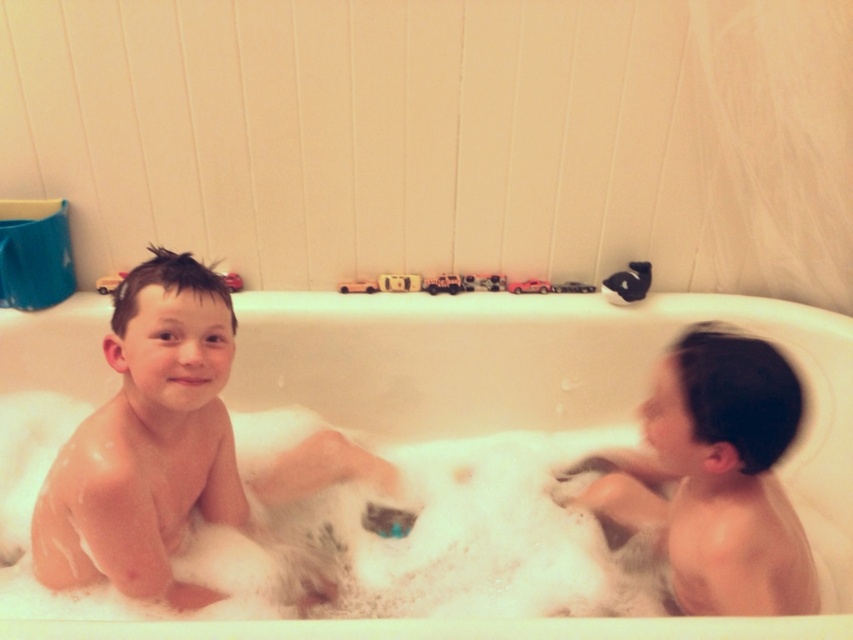
Question: Can you confirm if foamy white at bath bottom is smaller than smooth skin child at right?

Choices:
 (A) yes
 (B) no

Answer: (B)

Question: Does white foamy bath at center appear on the left side of foamy white at bath bottom?

Choices:
 (A) yes
 (B) no

Answer: (B)

Question: Which object is closer to the camera taking this photo?

Choices:
 (A) smooth skin child at right
 (B) smooth skin child at left

Answer: (A)

Question: Among these points, which one is nearest to the camera?

Choices:
 (A) (671, 529)
 (B) (161, 467)
 (C) (370, 413)

Answer: (B)

Question: Does foamy white at bath bottom appear on the left side of smooth skin child at right?

Choices:
 (A) yes
 (B) no

Answer: (A)

Question: Which object is the farthest from the foamy white at bath bottom?

Choices:
 (A) smooth skin child at right
 (B) white foamy bath at center

Answer: (A)